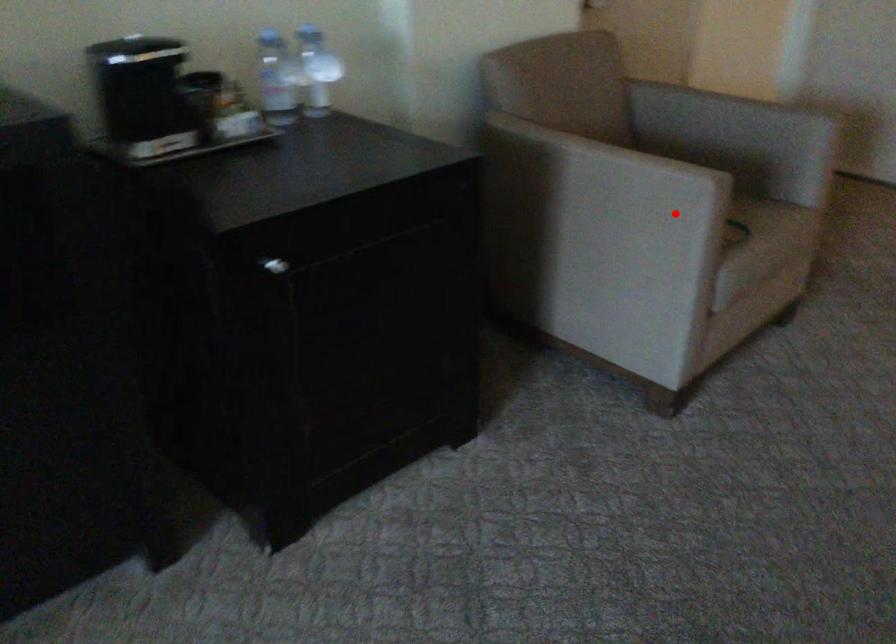
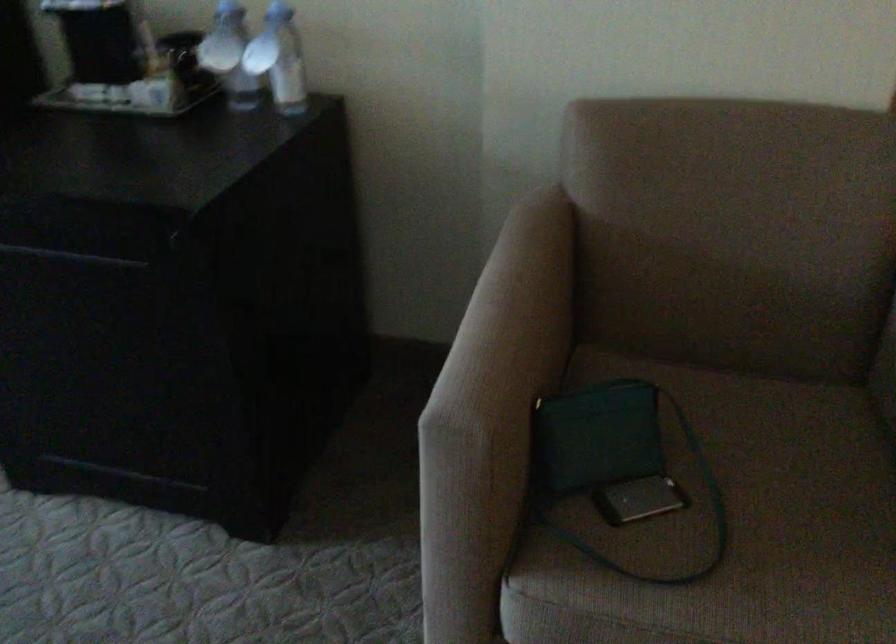
Question: I am providing you with two images of the same scene from different viewpoints. Image1 has a red point marked. In image2, the corresponding 3D location appears at what relative position? Reply with the corresponding letter.

Choices:
 (A) Closer
 (B) Farther

Answer: (A)